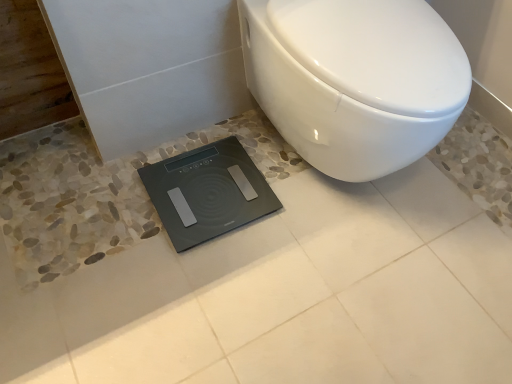
Where is `vacant space that is to the left of black glass scale at lower center`? The image size is (512, 384). vacant space that is to the left of black glass scale at lower center is located at coordinates (101, 203).